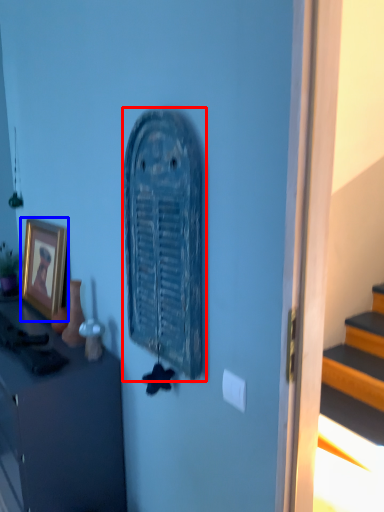
Question: Which object appears farthest to the camera in this image, art (highlighted by a red box) or picture frame (highlighted by a blue box)?

Choices:
 (A) art
 (B) picture frame

Answer: (B)